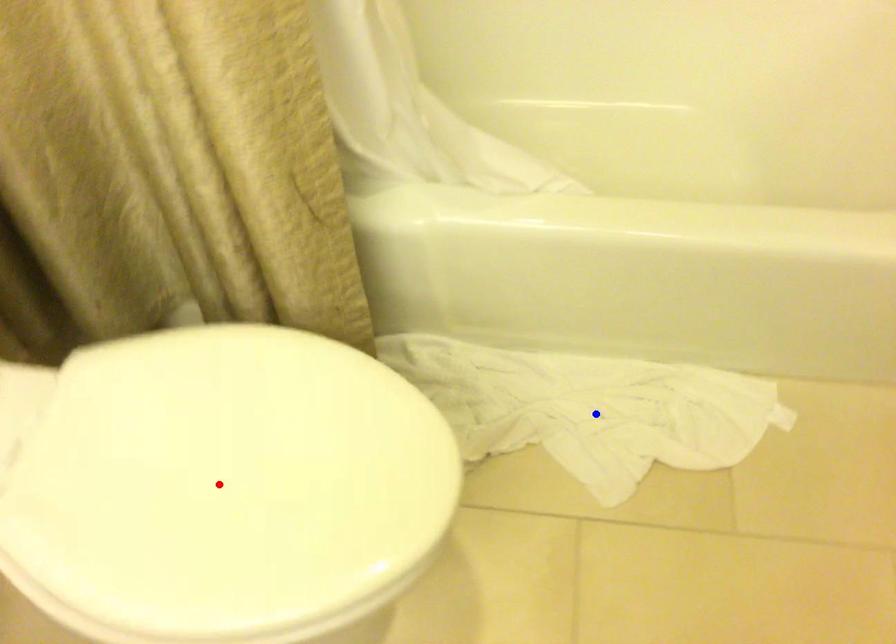
Question: Two points are marked on the image. Which point is closer to the camera?

Choices:
 (A) Blue point is closer.
 (B) Red point is closer.

Answer: (B)